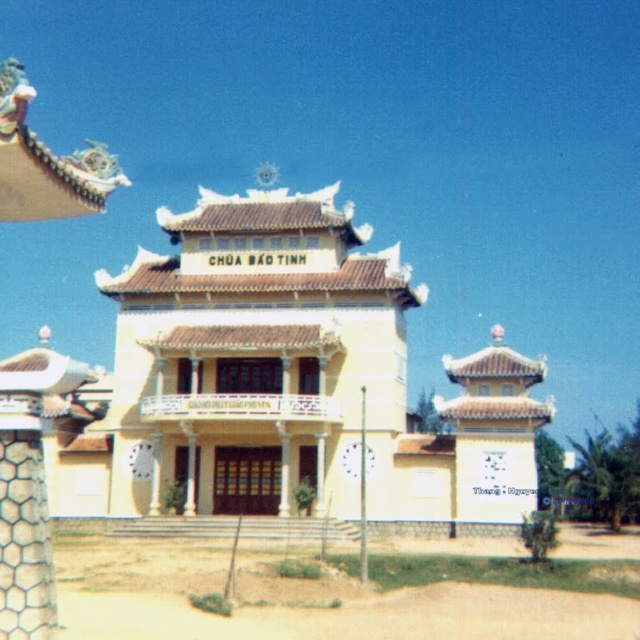
Can you confirm if yellow matte building at center is positioned below brown sandy dirt field at lower center?

No, yellow matte building at center is not below brown sandy dirt field at lower center.

Does point (305, 330) come behind point (573, 544)?

No, it is in front of (573, 544).

Locate an element on the screen. yellow matte building at center is located at coordinates (285, 381).

What do you see at coordinates (305, 600) in the screenshot? Image resolution: width=640 pixels, height=640 pixels. I see `brown sandy dirt field at lower center` at bounding box center [305, 600].

Does brown sandy dirt field at lower center appear under white hexagonal mesh at lower left?

Yes, brown sandy dirt field at lower center is below white hexagonal mesh at lower left.

At what (x,y) coordinates should I click in order to perform the action: click on brown sandy dirt field at lower center. Please return your answer as a coordinate pair (x, y). This screenshot has height=640, width=640. Looking at the image, I should click on (305, 600).

Is yellow matte building at center bigger than white hexagonal mesh at lower left?

Correct, yellow matte building at center is larger in size than white hexagonal mesh at lower left.

Consider the image. Can you confirm if yellow matte building at center is positioned above white hexagonal mesh at lower left?

Yes, yellow matte building at center is above white hexagonal mesh at lower left.

Which is in front, point (220, 266) or point (35, 451)?

Point (35, 451)

Where is `yellow matte building at center`? The height and width of the screenshot is (640, 640). yellow matte building at center is located at coordinates (285, 381).